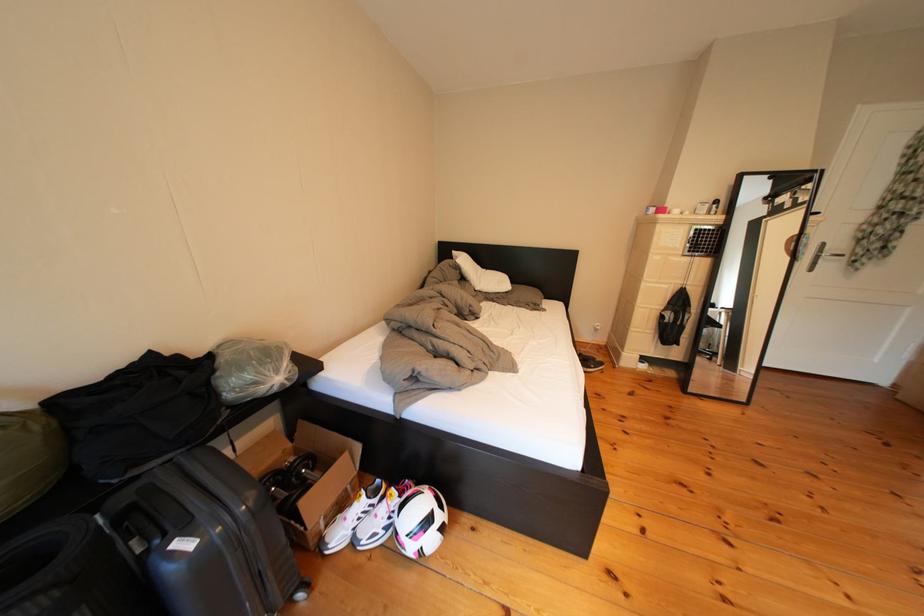
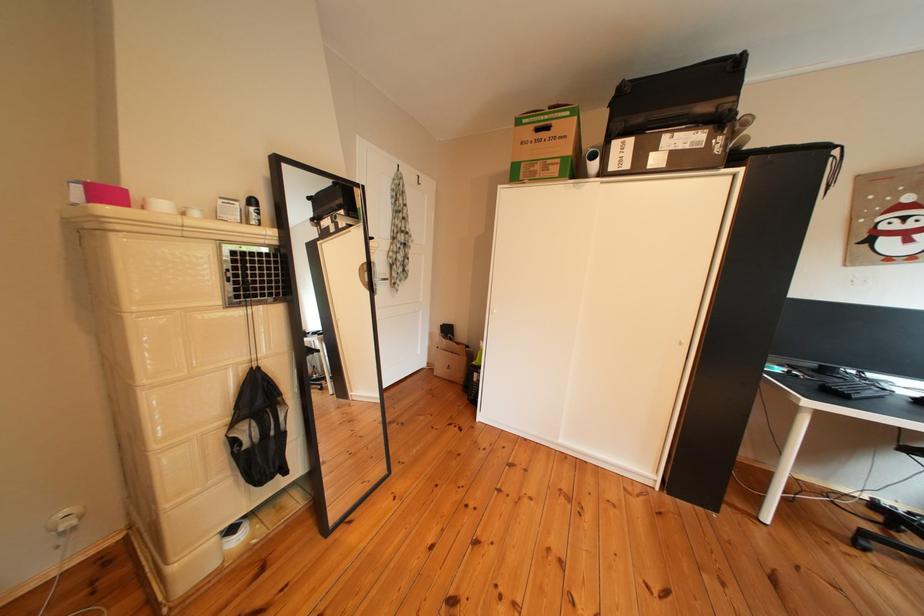
In the second image, find the point that corresponds to [676,322] in the first image.

(249, 447)